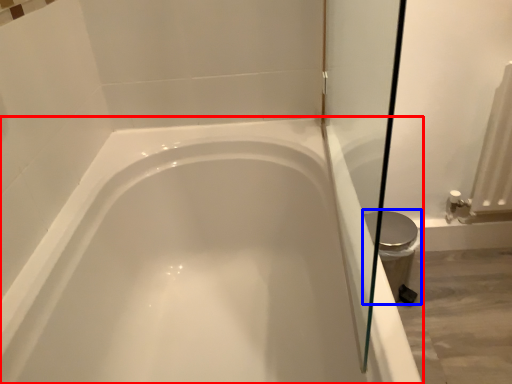
Question: Which of the following is the farthest to the observer, bathtub (highlighted by a red box) or bidet (highlighted by a blue box)?

Choices:
 (A) bathtub
 (B) bidet

Answer: (B)